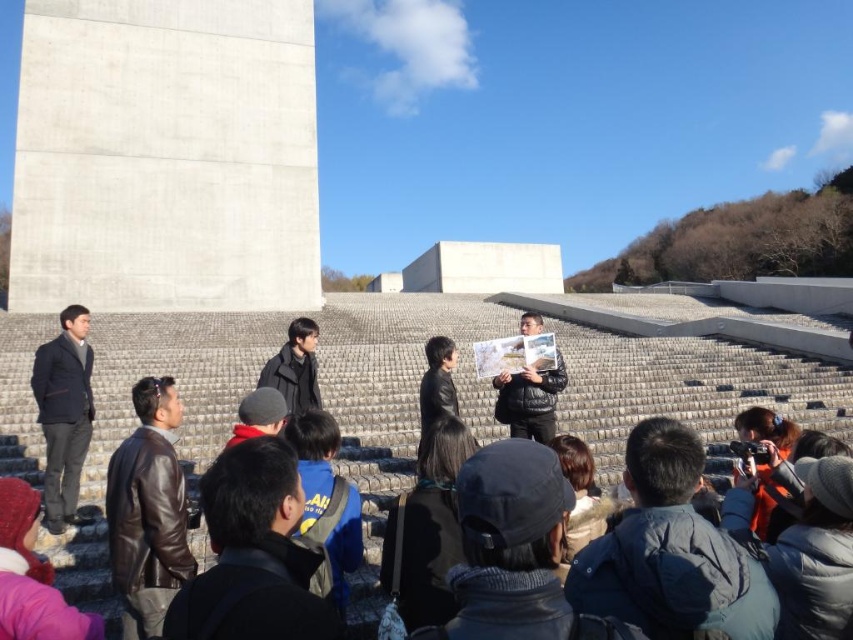
Consider the image. Can you confirm if black leather backpack at center is positioned to the left of pink woolen hat at lower left?

In fact, black leather backpack at center is to the right of pink woolen hat at lower left.

Can you confirm if black leather backpack at center is wider than pink woolen hat at lower left?

No.

At what (x,y) coordinates should I click in order to perform the action: click on black leather backpack at center. Please return your answer as a coordinate pair (x, y). The height and width of the screenshot is (640, 853). Looking at the image, I should click on (426, 529).

The image size is (853, 640). I want to click on black leather backpack at center, so click(x=426, y=529).

Measure the distance between point (618, 572) and camera.

Point (618, 572) and camera are 7.06 meters apart.

Is dark blue jacket at lower right above black leather backpack at center?

Yes.

Where is `dark blue jacket at lower right`? Image resolution: width=853 pixels, height=640 pixels. dark blue jacket at lower right is located at coordinates (670, 552).

Where is `dark blue jacket at lower right`? The width and height of the screenshot is (853, 640). dark blue jacket at lower right is located at coordinates (670, 552).

Can you confirm if dark blue jacket at lower right is bigger than orange fabric camera at lower right?

Yes.

Between dark blue jacket at lower right and orange fabric camera at lower right, which one appears on the left side from the viewer's perspective?

dark blue jacket at lower right is more to the left.

Does point (634, 440) come in front of point (775, 490)?

That is True.

At what (x,y) coordinates should I click in order to perform the action: click on dark blue jacket at lower right. Please return your answer as a coordinate pair (x, y). The image size is (853, 640). Looking at the image, I should click on (670, 552).